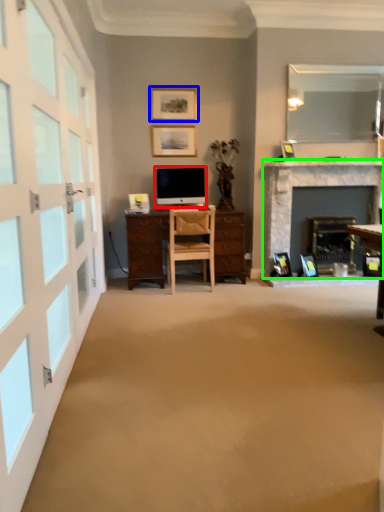
Question: Based on their relative distances, which object is nearer to television (highlighted by a red box)? Choose from picture frame (highlighted by a blue box) and fireplace (highlighted by a green box).

Choices:
 (A) picture frame
 (B) fireplace

Answer: (A)